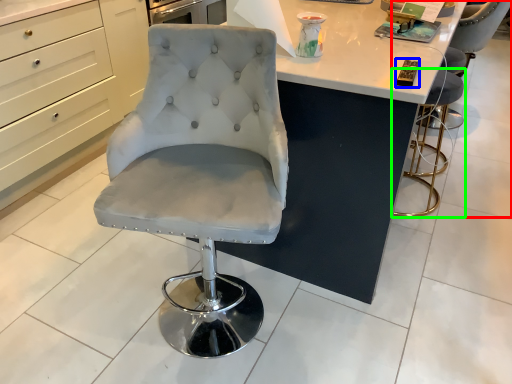
Question: Which object is the farthest from chair (highlighted by a red box)? Choose among these: magazine (highlighted by a blue box) or chair (highlighted by a green box).

Choices:
 (A) magazine
 (B) chair

Answer: (A)